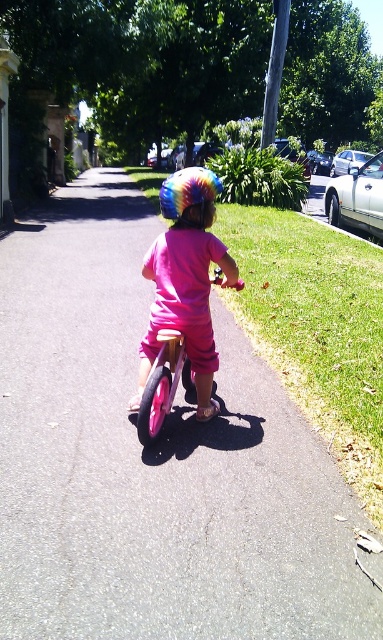
Question: Which object appears closest to the camera in this image?

Choices:
 (A) smooth asphalt at center
 (B) rainbow tie-dye helmet at center
 (C) rainbow helmet at center

Answer: (A)

Question: Is smooth asphalt at center further to the viewer compared to rainbow tie-dye helmet at center?

Choices:
 (A) no
 (B) yes

Answer: (A)

Question: Does smooth asphalt at center have a lesser width compared to rainbow tie-dye helmet at center?

Choices:
 (A) yes
 (B) no

Answer: (B)

Question: Which point is closer to the camera?

Choices:
 (A) (191, 618)
 (B) (199, 216)
 (C) (214, 177)

Answer: (A)

Question: Is smooth asphalt at center wider than rainbow helmet at center?

Choices:
 (A) yes
 (B) no

Answer: (A)

Question: Which point appears closest to the camera in this image?

Choices:
 (A) (230, 436)
 (B) (181, 180)

Answer: (B)